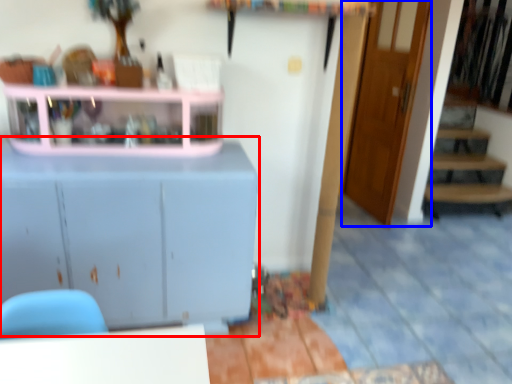
Question: Which object appears closest to the camera in this image, cabinetry (highlighted by a red box) or door (highlighted by a blue box)?

Choices:
 (A) cabinetry
 (B) door

Answer: (A)